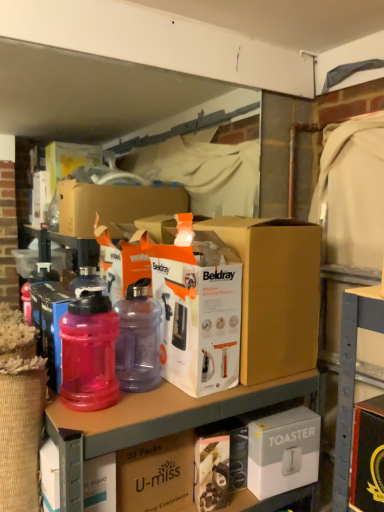
Question: Should I look upward or downward to see transparent plastic bottles at upper center?

Choices:
 (A) down
 (B) up

Answer: (A)

Question: Would you say purple translucent bottle at center, the first bottle when ordered from right to left, is outside transparent plastic water bottle at left, the 4th box when ordered from right to left?

Choices:
 (A) no
 (B) yes

Answer: (B)

Question: Is purple translucent bottle at center, the second bottle when ordered from left to right, behind transparent plastic water bottle at left, the 4th box when ordered from right to left?

Choices:
 (A) no
 (B) yes

Answer: (A)

Question: Is purple translucent bottle at center, the second bottle when ordered from left to right, taller than transparent plastic water bottle at left, acting as the 1th box starting from the left?

Choices:
 (A) no
 (B) yes

Answer: (B)

Question: Is purple translucent bottle at center, the first bottle when ordered from right to left, to the left of transparent plastic water bottle at left, the 4th box when ordered from right to left, from the viewer's perspective?

Choices:
 (A) no
 (B) yes

Answer: (A)

Question: From a real-world perspective, does purple translucent bottle at center, the second bottle when ordered from left to right, stand above transparent plastic water bottle at left, acting as the 1th box starting from the left?

Choices:
 (A) no
 (B) yes

Answer: (B)

Question: Does purple translucent bottle at center, the first bottle when ordered from right to left, have a greater width compared to transparent plastic water bottle at left, the 4th box when ordered from right to left?

Choices:
 (A) yes
 (B) no

Answer: (A)

Question: Is white cardboard toaster at lower right, which ranks as the fourth box in left-to-right order, taller than purple translucent bottle at center, the second bottle when ordered from left to right?

Choices:
 (A) yes
 (B) no

Answer: (B)

Question: Are white cardboard toaster at lower right, which ranks as the fourth box in left-to-right order, and purple translucent bottle at center, the first bottle when ordered from right to left, located far from each other?

Choices:
 (A) yes
 (B) no

Answer: (B)

Question: Could you tell me if white cardboard toaster at lower right, the 1th box in the right-to-left sequence, is facing purple translucent bottle at center, the first bottle when ordered from right to left?

Choices:
 (A) yes
 (B) no

Answer: (B)

Question: From a real-world perspective, is white cardboard toaster at lower right, the 1th box in the right-to-left sequence, positioned under purple translucent bottle at center, the second bottle when ordered from left to right, based on gravity?

Choices:
 (A) no
 (B) yes

Answer: (B)

Question: Is white cardboard toaster at lower right, the 1th box in the right-to-left sequence, at the right side of purple translucent bottle at center, the second bottle when ordered from left to right?

Choices:
 (A) yes
 (B) no

Answer: (A)

Question: Does white cardboard toaster at lower right, the 1th box in the right-to-left sequence, have a lesser height compared to purple translucent bottle at center, the first bottle when ordered from right to left?

Choices:
 (A) yes
 (B) no

Answer: (A)

Question: From a real-world perspective, is purple translucent bottle at center, the second bottle when ordered from left to right, located higher than transparent plastic bottles at upper center?

Choices:
 (A) no
 (B) yes

Answer: (B)